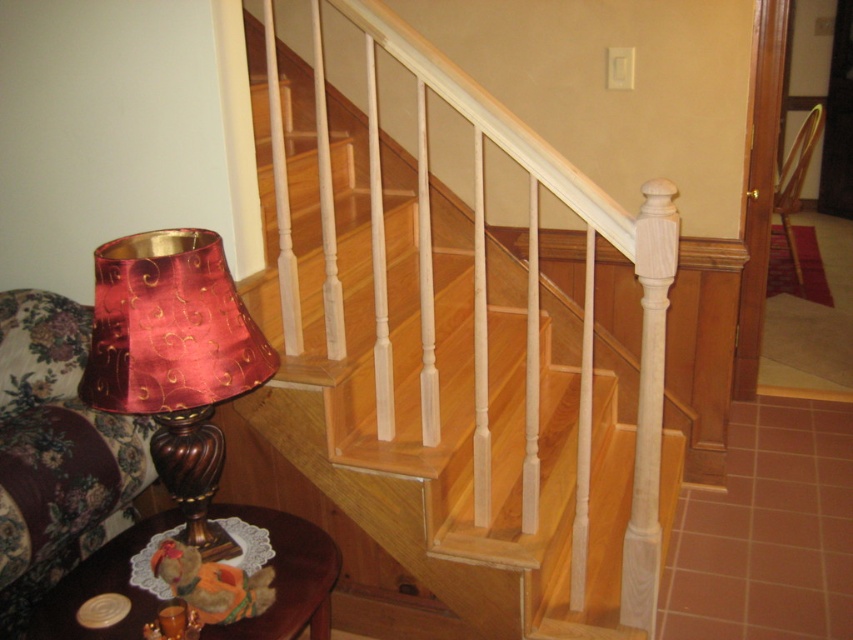
You are moving a large piece of furniture that is the same size as the natural wood stairs at upper center. You want to place it where the brown wooden stool at lower left is currently located. Will the space be sufficient?

The natural wood stairs at upper center is bigger than the brown wooden stool at lower left, so the space where the brown wooden stool at lower left is located may not be sufficient to accommodate the larger furniture piece.

You are a delivery person carrying a large package that is 36 inches long. You need to move from the floral fabric armchair at left to the natural wood stairs at upper center. Can you maneuver the package through the space between them without tilting it?

The distance between the natural wood stairs at upper center and the floral fabric armchair at left is 30.03 inches. Since the package is 36 inches long, it is longer than the available space, so you cannot maneuver it without tilting or repositioning the package.

You are standing at the bottom of the natural wood stairs at upper center and want to place a new decorative item on the step closest to you. Which direction should you look to place it correctly?

The natural wood stairs at upper center are located at point (x=457, y=358), so you should look upwards towards the stairs to place the decorative item on the step closest to you.